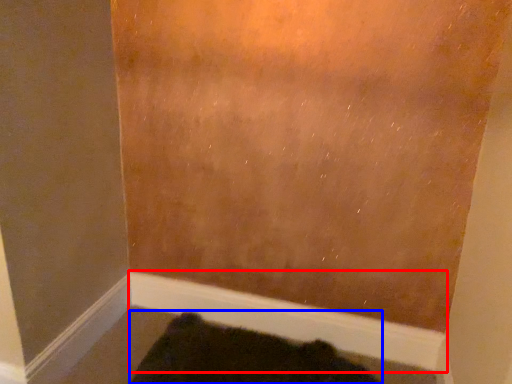
Question: Which point is further to the camera, molding (highlighted by a red box) or animal (highlighted by a blue box)?

Choices:
 (A) molding
 (B) animal

Answer: (A)